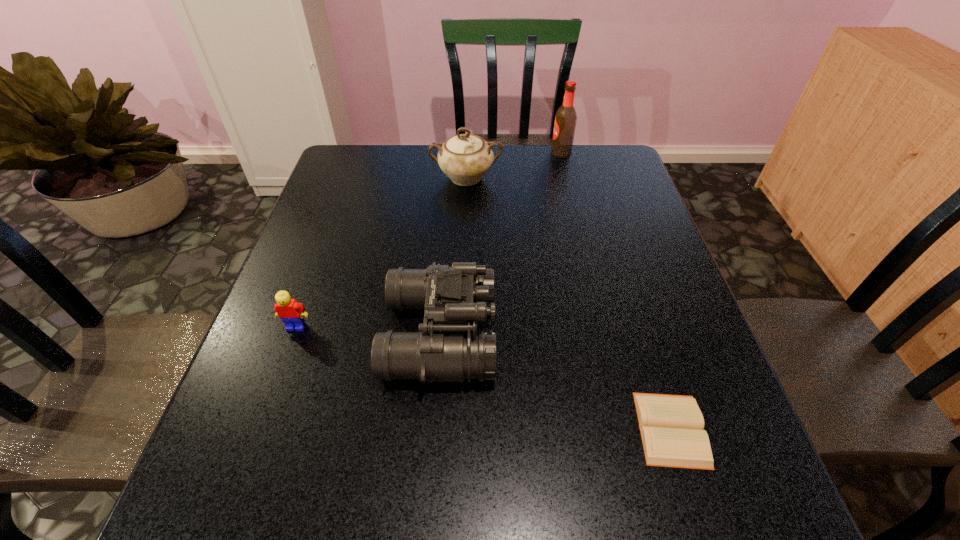
Image resolution: width=960 pixels, height=540 pixels. In order to click on free space between the shortest object and the binoculars in this screenshot , I will do `click(556, 382)`.

Identify which object is the fourth nearest to the fourth nearest object. Please provide its 2D coordinates. Your answer should be formatted as a tuple, i.e. [(x, y)], where the tuple contains the x and y coordinates of a point satisfying the conditions above.

[(671, 426)]

You are a GUI agent. You are given a task and a screenshot of the screen. Output one action in this format:
    pyautogui.click(x=<x>, y=<y>)
    Task: Click on the fourth closest object to the tallest object
    The image size is (960, 540).
    Given the screenshot: What is the action you would take?
    pyautogui.click(x=291, y=312)

The height and width of the screenshot is (540, 960). In order to click on vacant position in the image that satisfies the following two spatial constraints: 1. on the front-facing side of the Lego; 2. on the right side of the diary in this screenshot , I will do `click(259, 429)`.

The height and width of the screenshot is (540, 960). I want to click on free location that satisfies the following two spatial constraints: 1. through the lenses of the binoculars; 2. on the back side of the shortest object, so click(433, 429).

At what (x,y) coordinates should I click in order to perform the action: click on free point that satisfies the following two spatial constraints: 1. on the front side of the second farthest object; 2. on the right side of the shortest object. Please return your answer as a coordinate pair (x, y). Looking at the image, I should click on (456, 429).

Where is `vacant space that satisfies the following two spatial constraints: 1. on the front side of the chinaware; 2. on the left side of the diary`? This screenshot has height=540, width=960. vacant space that satisfies the following two spatial constraints: 1. on the front side of the chinaware; 2. on the left side of the diary is located at coordinates (456, 429).

Identify the location of vacant space that satisfies the following two spatial constraints: 1. through the lenses of the shortest object; 2. on the left side of the binoculars. This screenshot has height=540, width=960. (433, 429).